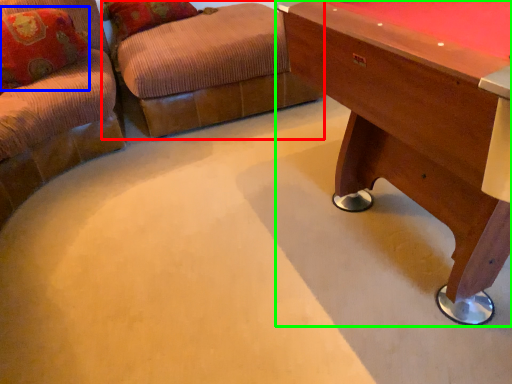
Question: Based on their relative distances, which object is farther from swivel chair (highlighted by a red box)? Choose from pillow (highlighted by a blue box) and table (highlighted by a green box).

Choices:
 (A) pillow
 (B) table

Answer: (B)